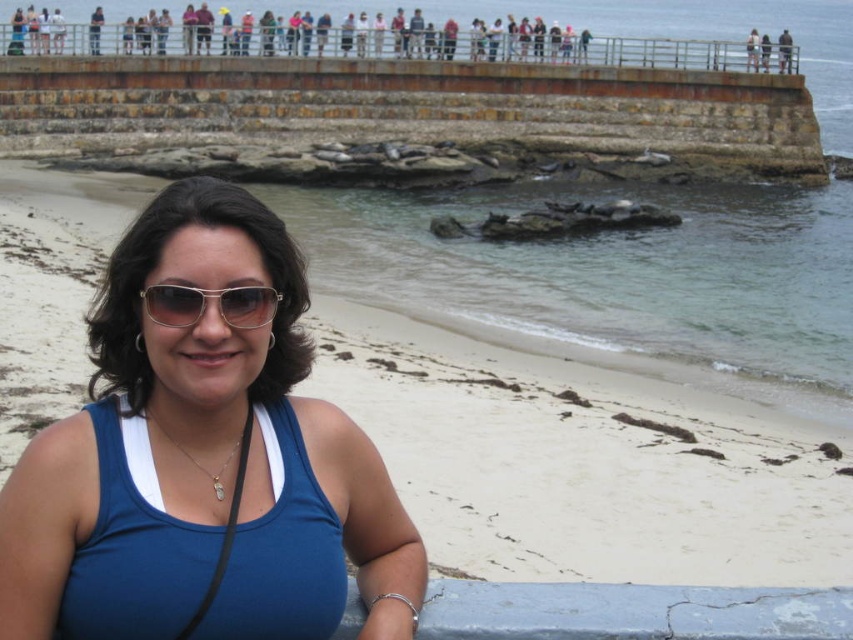
Question: Does matte blue tank top at center appear on the left side of gold metallic sunglasses at center?

Choices:
 (A) yes
 (B) no

Answer: (A)

Question: Which point is closer to the camera?

Choices:
 (A) matte blue tank top at center
 (B) gold metallic sunglasses at center

Answer: (B)

Question: Can you confirm if matte blue tank top at center is wider than gold metallic sunglasses at center?

Choices:
 (A) no
 (B) yes

Answer: (B)

Question: Can you confirm if matte blue tank top at center is bigger than gold metallic sunglasses at center?

Choices:
 (A) yes
 (B) no

Answer: (A)

Question: Among these objects, which one is farthest from the camera?

Choices:
 (A) matte blue tank top at center
 (B) gold metallic sunglasses at center

Answer: (A)

Question: Which point is closer to the camera taking this photo?

Choices:
 (A) (281, 550)
 (B) (210, 292)

Answer: (A)